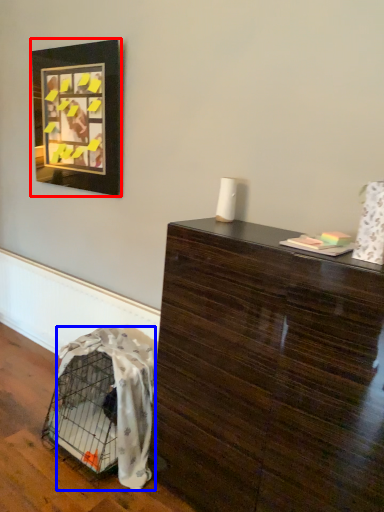
Question: Which object appears farthest to the camera in this image, picture frame (highlighted by a red box) or blanket (highlighted by a blue box)?

Choices:
 (A) picture frame
 (B) blanket

Answer: (A)